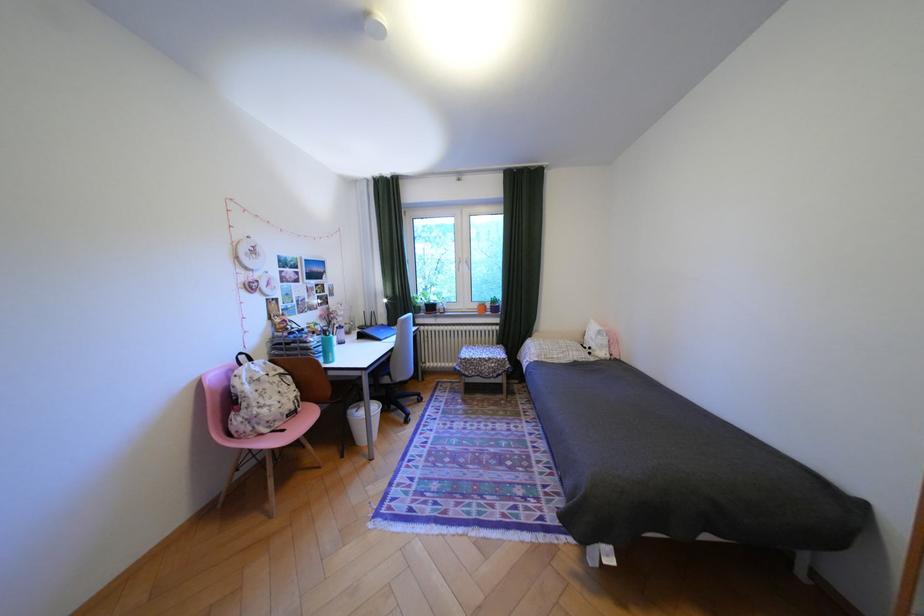
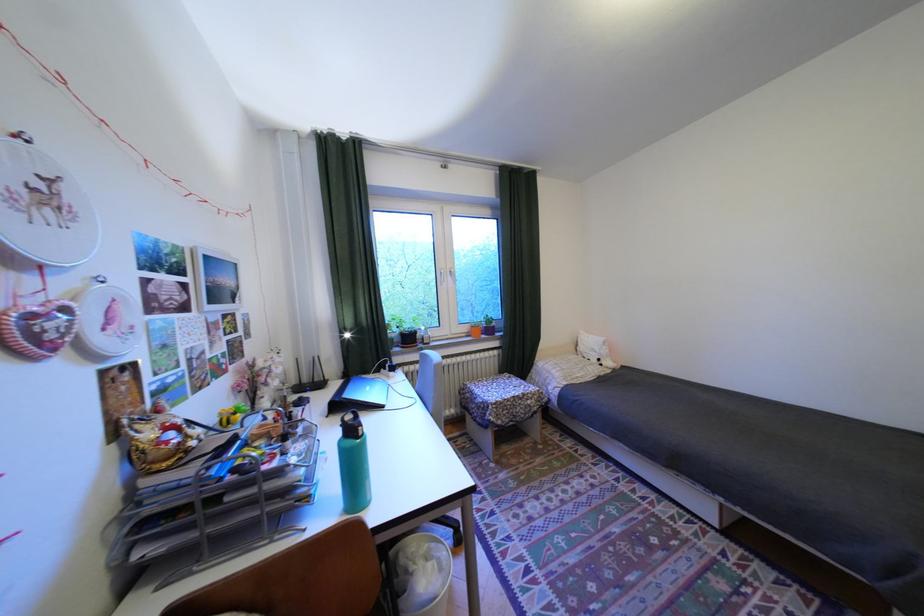
Find the pixel in the second image that matches pixel 265 252 in the first image.

(58, 197)